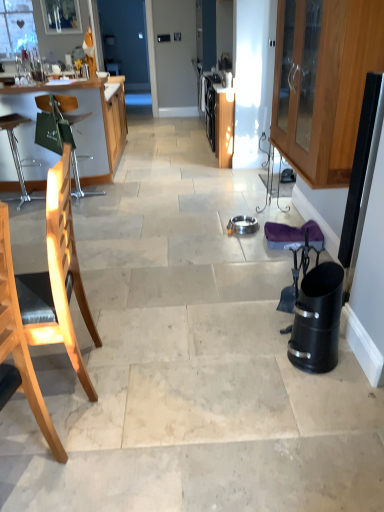
This screenshot has height=512, width=384. Find the location of `vacant space in front of light wood chair at left, positioned as the 2th chair in back-to-front order`. vacant space in front of light wood chair at left, positioned as the 2th chair in back-to-front order is located at coordinates (62, 431).